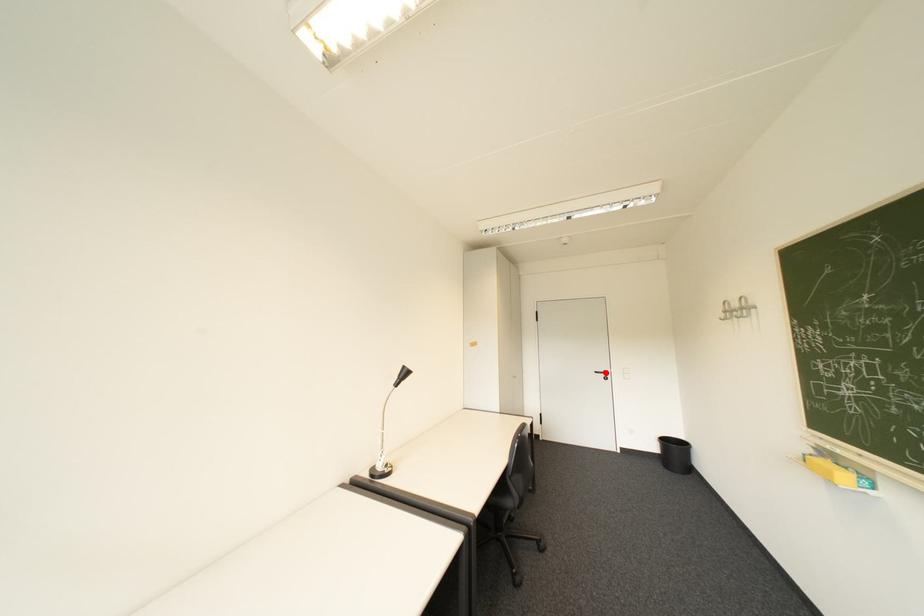
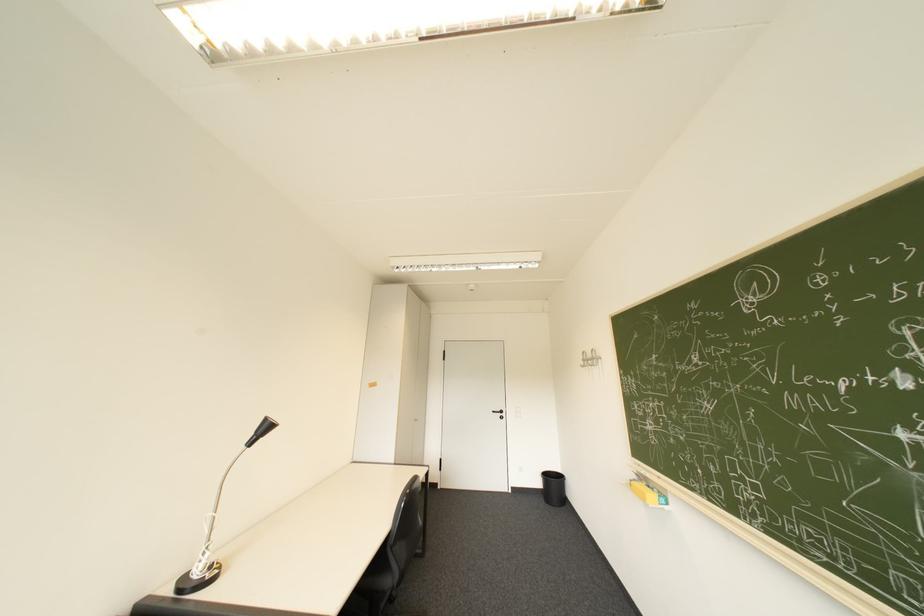
Find the pixel in the second image that matches the highlighted location in the first image.

(504, 411)